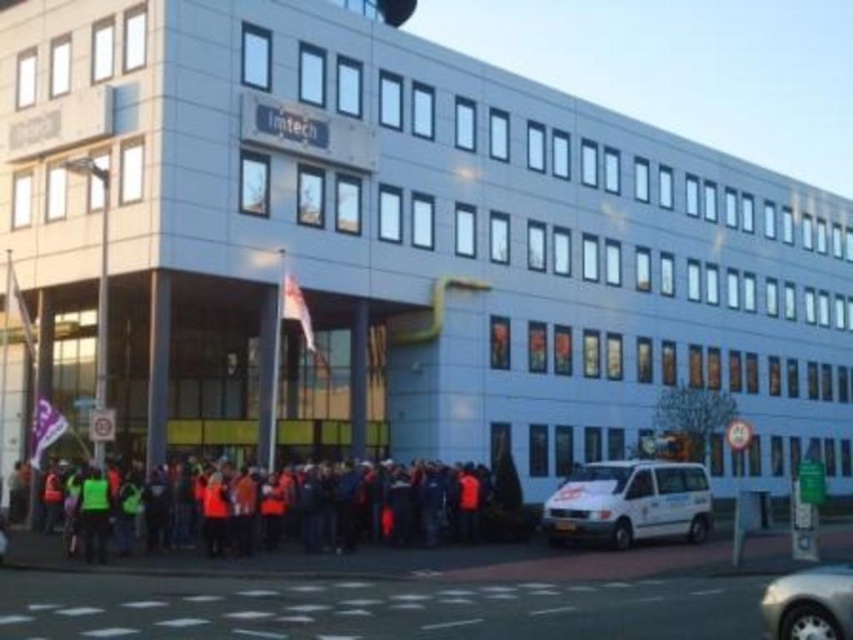
Question: Is orange reflective jackets at lower center further to camera compared to white matte van at lower right?

Choices:
 (A) no
 (B) yes

Answer: (A)

Question: Which point is closer to the camera?

Choices:
 (A) (785, 624)
 (B) (434, 508)
 (C) (705, 515)

Answer: (A)

Question: Observing the image, what is the correct spatial positioning of orange reflective jackets at lower center in reference to white matte van at lower right?

Choices:
 (A) right
 (B) left

Answer: (B)

Question: Is orange reflective jackets at lower center below silver metallic car at lower right?

Choices:
 (A) yes
 (B) no

Answer: (A)

Question: Which point is farther from the camera taking this photo?

Choices:
 (A) (200, 545)
 (B) (606, 524)
 (C) (784, 616)

Answer: (A)

Question: Which point appears closest to the camera in this image?

Choices:
 (A) (791, 596)
 (B) (239, 509)
 (C) (560, 524)

Answer: (A)